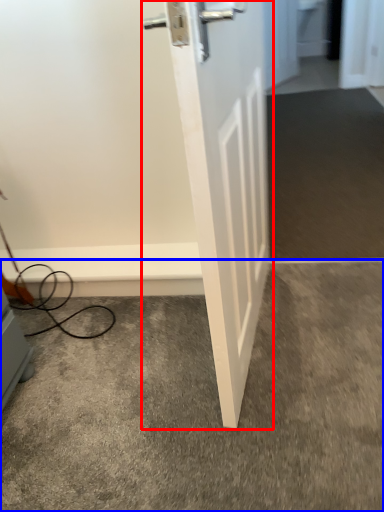
Question: Which object appears closest to the camera in this image, door (highlighted by a red box) or concrete (highlighted by a blue box)?

Choices:
 (A) door
 (B) concrete

Answer: (A)